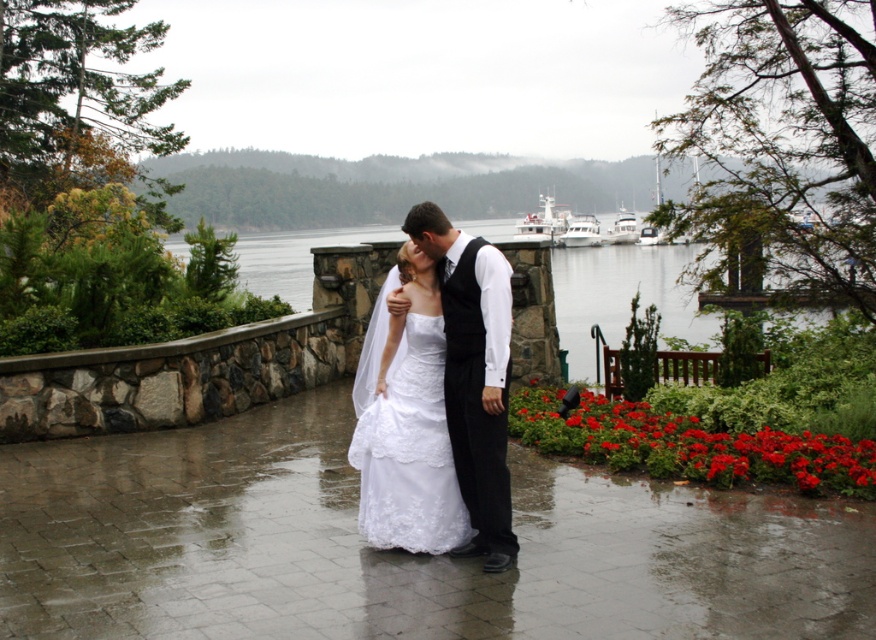
Question: Which point is farther to the camera?

Choices:
 (A) (366, 241)
 (B) (415, 492)
 (C) (584, 218)
 (D) (414, 205)

Answer: (A)

Question: Where is black satin vest at center located in relation to clear water at center in the image?

Choices:
 (A) left
 (B) right

Answer: (A)

Question: Is white lace dress at center positioned behind white glossy boat at upper center?

Choices:
 (A) no
 (B) yes

Answer: (A)

Question: Is the position of clear water at center less distant than that of white lace dress at center?

Choices:
 (A) yes
 (B) no

Answer: (B)

Question: Which object appears closest to the camera in this image?

Choices:
 (A) black satin vest at center
 (B) clear water at center
 (C) white lace dress at center

Answer: (A)

Question: Which point appears closest to the camera in this image?

Choices:
 (A) (492, 509)
 (B) (581, 232)
 (C) (384, 529)

Answer: (A)